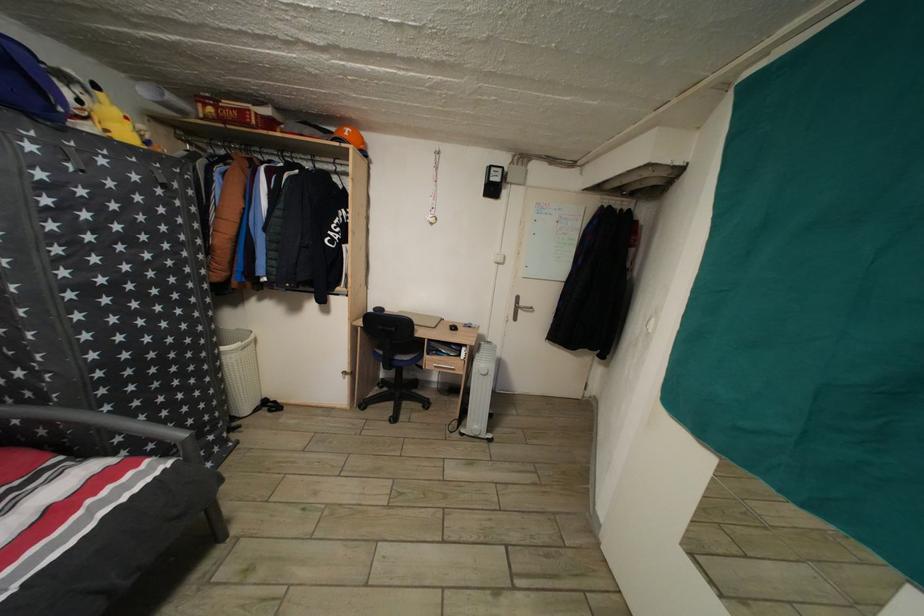
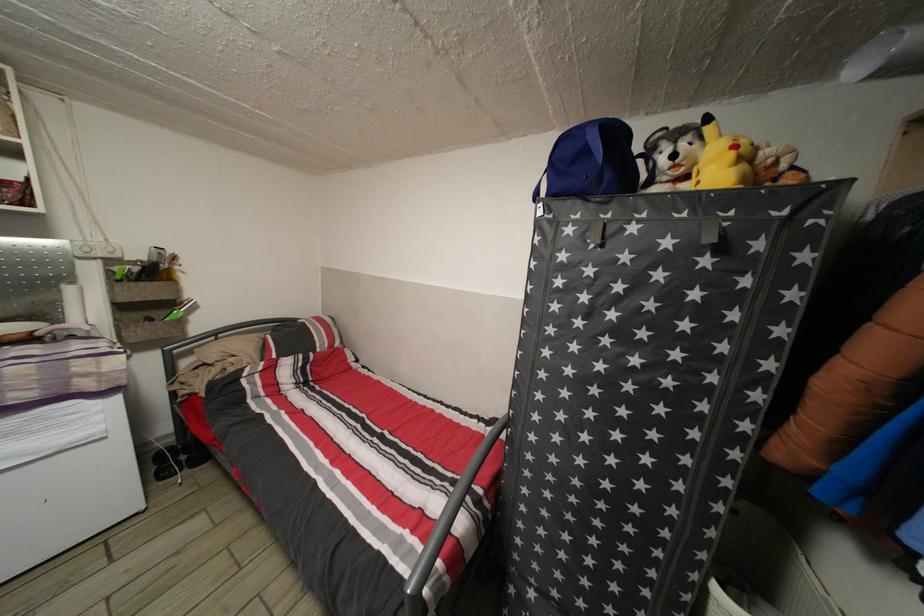
In the second image, find the point that corresponds to pixel 229 355 in the first image.

(723, 594)